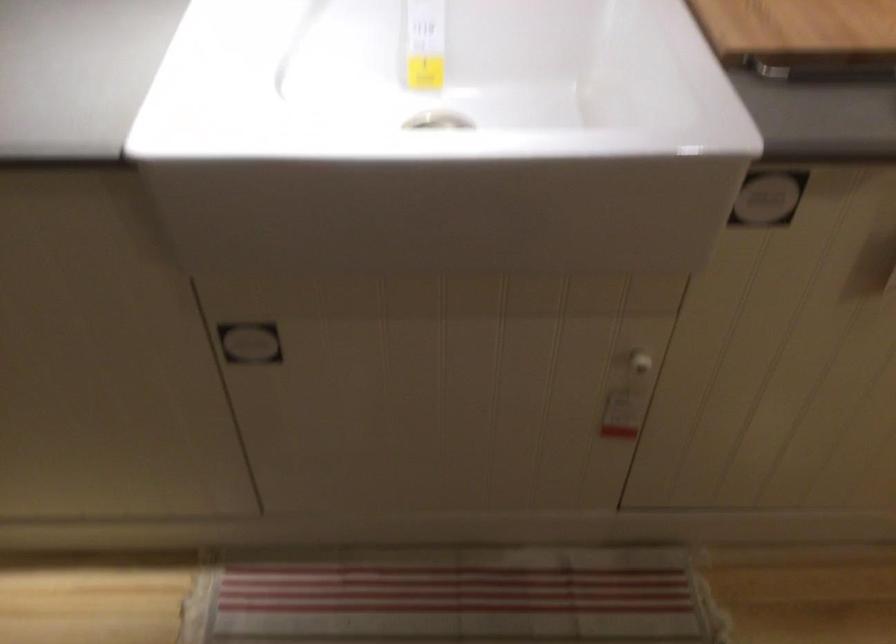
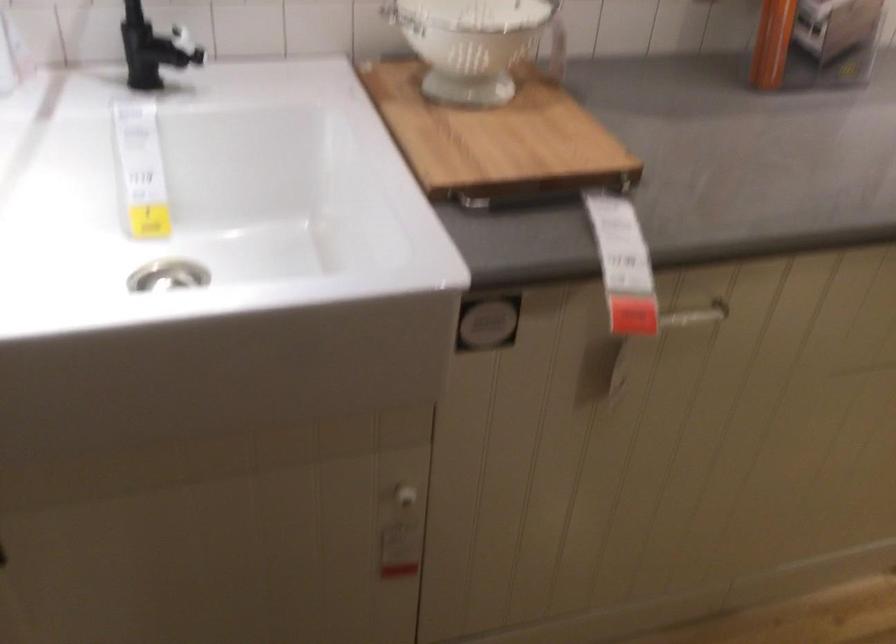
Question: What movement of the cameraman would produce the second image?

Choices:
 (A) Left
 (B) Right
 (C) Forward
 (D) Backward

Answer: (B)